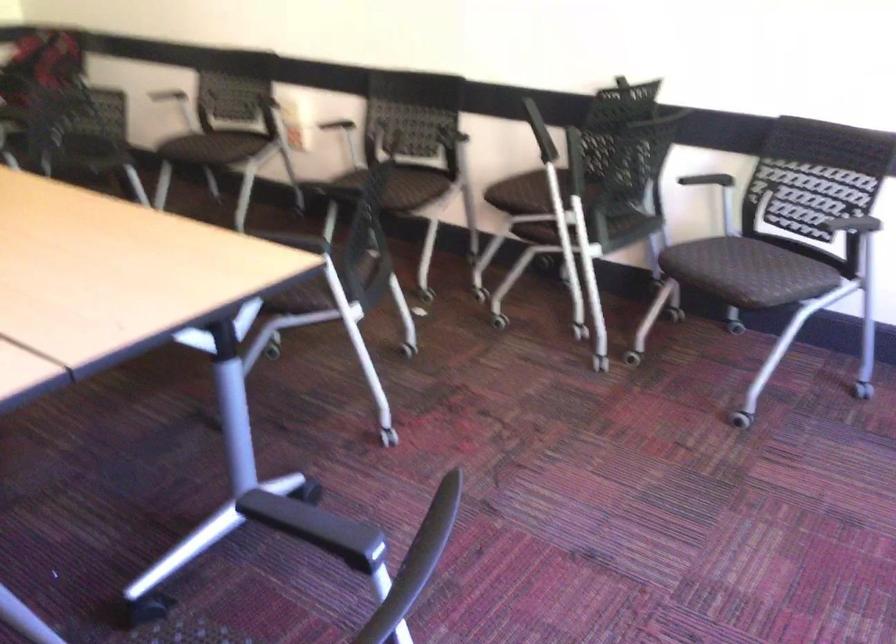
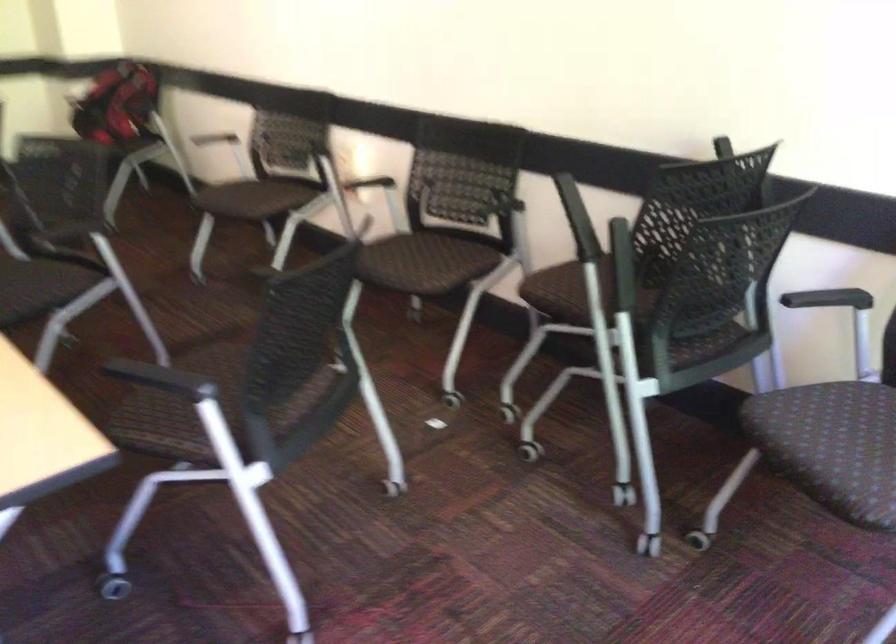
Question: The camera is either moving clockwise (left) or counter-clockwise (right) around the object. The first image is from the beginning of the video and the second image is from the end. Is the camera moving left or right when shooting the video?

Choices:
 (A) Left
 (B) Right

Answer: (B)